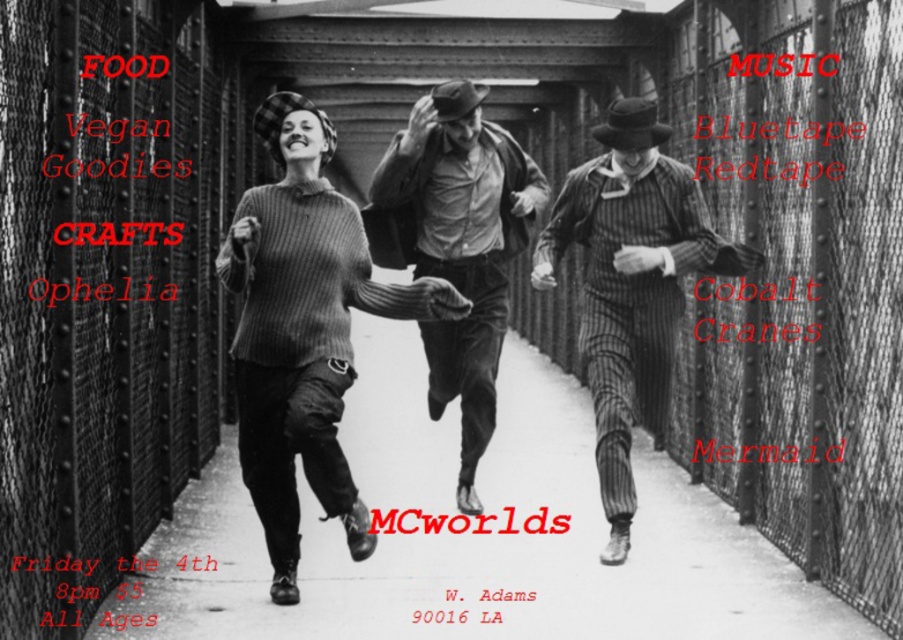
Question: Which object is farther from the camera taking this photo?

Choices:
 (A) striped wool suit at center
 (B) knitted sweater at center
 (C) smooth leather jacket at center

Answer: (C)

Question: Can you confirm if knitted sweater at center is bigger than smooth leather jacket at center?

Choices:
 (A) no
 (B) yes

Answer: (A)

Question: Is knitted sweater at center thinner than smooth leather jacket at center?

Choices:
 (A) no
 (B) yes

Answer: (A)

Question: Considering the real-world distances, which object is farthest from the striped wool suit at center?

Choices:
 (A) smooth leather jacket at center
 (B) knitted sweater at center

Answer: (B)

Question: Which object appears farthest from the camera in this image?

Choices:
 (A) striped wool suit at center
 (B) knitted sweater at center
 (C) smooth leather jacket at center

Answer: (C)

Question: Is knitted sweater at center wider than smooth leather jacket at center?

Choices:
 (A) yes
 (B) no

Answer: (A)